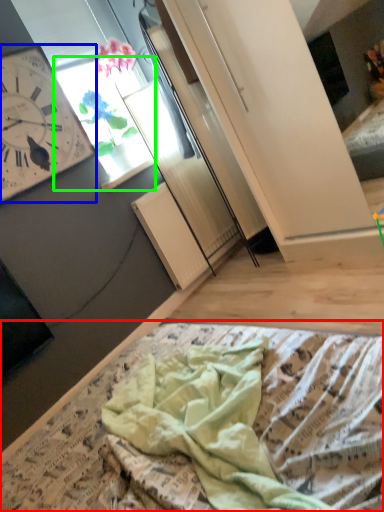
Question: Considering the real-world distances, which object is farthest from blanket (highlighted by a red box)? wall clock (highlighted by a blue box) or window (highlighted by a green box)?

Choices:
 (A) wall clock
 (B) window

Answer: (B)